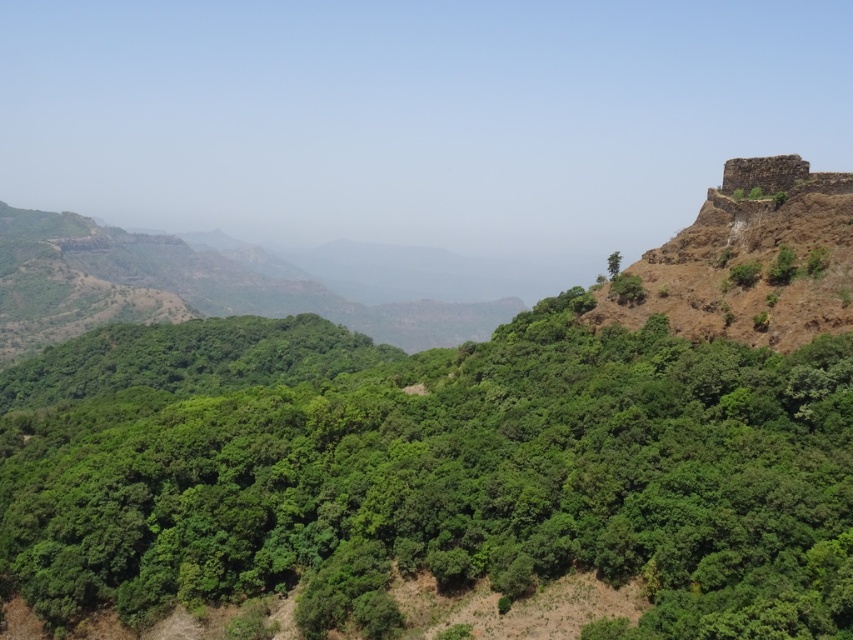
You are a hiker planning to take a photo of both the rustic stone fort at upper right and the green leafy tree at upper right from a spot that can see both. Based on their distance apart, what is the minimum distance you need to be from the closer object to ensure both are in frame?

The rustic stone fort at upper right and green leafy tree at upper right are 19.73 meters apart. To ensure both are in frame, you need to be at least 19.73 meters away from the closer object.

You are a hiker planning to take a photo of the rustic stone fort at upper right and the green leafy trees at center. Which object should you position closer to the edge of your camera frame to ensure both fit in the shot?

You should position the rustic stone fort at upper right closer to the edge of your camera frame because the green leafy trees at center are wider, so placing the narrower rustic stone fort at upper right near the edge allows both to fit within the frame.